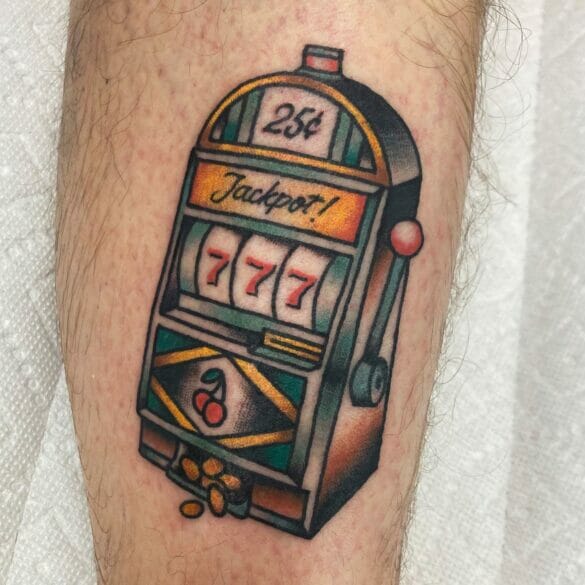
You are a GUI agent. You are given a task and a screenshot of the screen. Output one action in this format:
    pyautogui.click(x=<x>, y=<y>)
    Task: Click on the paper towel
    
    Given the screenshot: What is the action you would take?
    click(x=17, y=446), click(x=51, y=519), click(x=552, y=521)